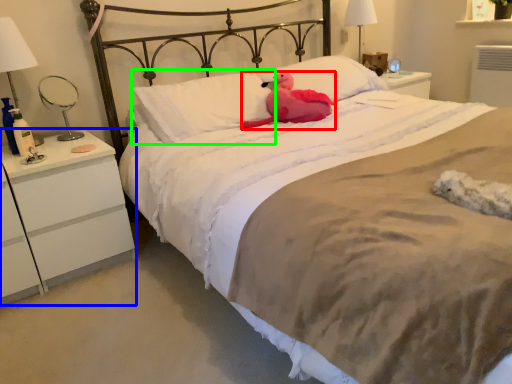
Question: Which object is positioned closest to animal (highlighted by a red box)? Select from nightstand (highlighted by a blue box) and pillow (highlighted by a green box).

Choices:
 (A) nightstand
 (B) pillow

Answer: (B)